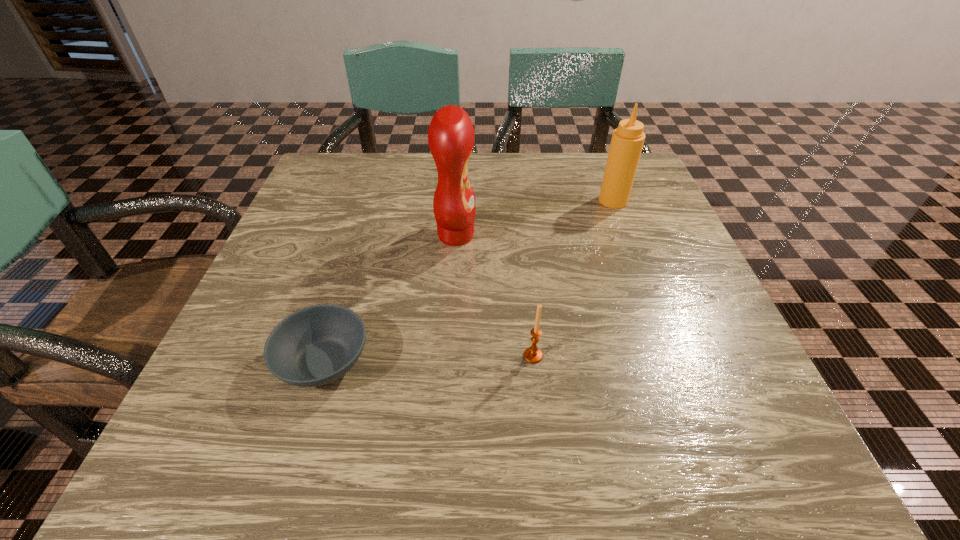
You are a GUI agent. You are given a task and a screenshot of the screen. Output one action in this format:
    pyautogui.click(x=<x>, y=<y>)
    Task: Click on the free spot located 0.330m on the left of the candle_holder
    The width and height of the screenshot is (960, 540).
    Given the screenshot: What is the action you would take?
    pyautogui.click(x=315, y=356)

Identify the location of free space located on the right of the soup bowl. (512, 362).

Locate an element on the screen. This screenshot has height=540, width=960. object that is at the far edge is located at coordinates (627, 141).

I want to click on object that is at the left edge, so click(314, 346).

This screenshot has width=960, height=540. What are the coordinates of `object situated at the right edge` in the screenshot? It's located at (627, 141).

The height and width of the screenshot is (540, 960). Identify the location of object present at the far right corner. (627, 141).

Locate an element on the screen. blank area at the far edge is located at coordinates (419, 168).

The width and height of the screenshot is (960, 540). Find the location of `vacant area at the near edge of the desktop`. vacant area at the near edge of the desktop is located at coordinates (640, 430).

In order to click on free point at the left edge in this screenshot , I will do `click(237, 336)`.

Image resolution: width=960 pixels, height=540 pixels. Identify the location of vacant region at the right edge of the desktop. (648, 267).